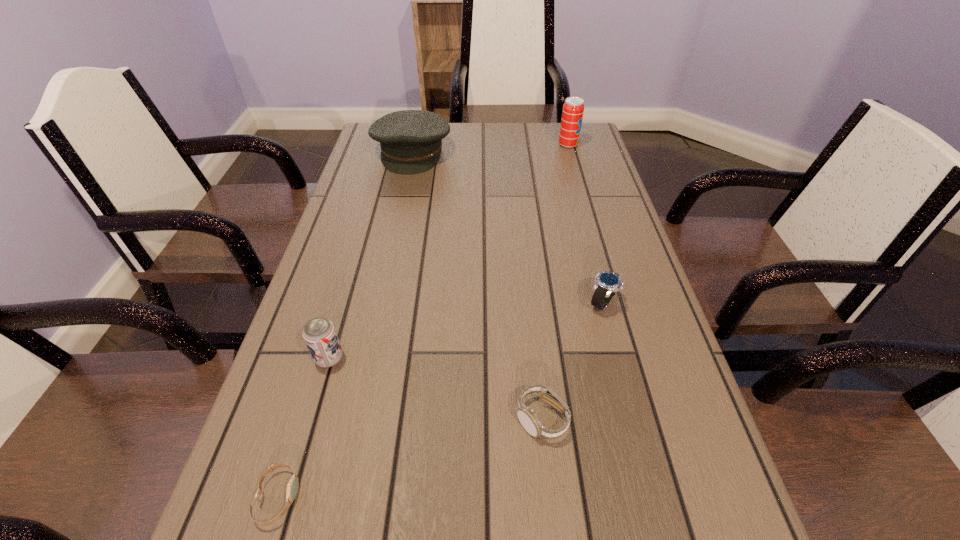
In order to click on free space that is in between the fourth farthest object and the second watch from right to left in this screenshot , I will do `click(435, 388)`.

This screenshot has width=960, height=540. I want to click on free space that is in between the third farthest object and the nearest watch, so click(440, 400).

This screenshot has width=960, height=540. What are the coordinates of `vacant space in between the second tallest object and the tallest object` in the screenshot? It's located at (490, 148).

Choose which object is the second nearest neighbor to the nearest object. Please provide its 2D coordinates. Your answer should be formatted as a tuple, i.e. [(x, y)], where the tuple contains the x and y coordinates of a point satisfying the conditions above.

[(527, 417)]

Image resolution: width=960 pixels, height=540 pixels. In order to click on the fifth closest object relative to the tallest object in this screenshot , I will do `click(292, 487)`.

Choose which watch is the second nearest neighbor to the third tallest object. Please provide its 2D coordinates. Your answer should be formatted as a tuple, i.e. [(x, y)], where the tuple contains the x and y coordinates of a point satisfying the conditions above.

[(527, 417)]

Where is `watch that is the closest to the leftmost watch`? The image size is (960, 540). watch that is the closest to the leftmost watch is located at coordinates (527, 417).

The height and width of the screenshot is (540, 960). I want to click on free space that satisfies the following two spatial constraints: 1. on the front side of the third farthest object; 2. on the face of the shortest object, so click(x=653, y=497).

This screenshot has height=540, width=960. Identify the location of free location that satisfies the following two spatial constraints: 1. on the front-facing side of the beret; 2. on the face of the shortest watch. (338, 497).

Find the location of `vacant space that satisfies the following two spatial constraints: 1. on the front side of the farthest watch; 2. on the face of the nearest object`. vacant space that satisfies the following two spatial constraints: 1. on the front side of the farthest watch; 2. on the face of the nearest object is located at coordinates (653, 497).